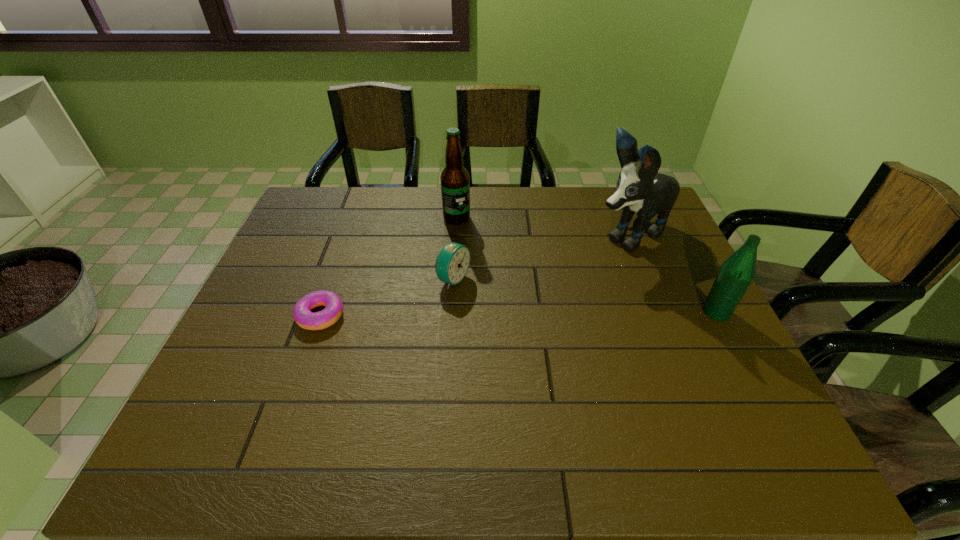
Image resolution: width=960 pixels, height=540 pixels. Identify the location of vacant area situated on the front-facing side of the alarm clock. (563, 329).

You are a GUI agent. You are given a task and a screenshot of the screen. Output one action in this format:
    pyautogui.click(x=<x>, y=<y>)
    Task: Click on the free spot located 0.090m on the front-facing side of the alarm clock
    The image size is (960, 540).
    Given the screenshot: What is the action you would take?
    [496, 300]

Find the location of a particular element. vacant space located 0.130m on the front-facing side of the tallest object is located at coordinates 568,268.

The image size is (960, 540). In order to click on vacant space located 0.380m on the front-facing side of the tallest object in this screenshot , I will do `click(499, 306)`.

I want to click on vacant area located on the front-facing side of the tallest object, so click(x=540, y=284).

The image size is (960, 540). What are the coordinates of `vacant space situated 0.190m on the label of the beer bottle` in the screenshot? It's located at (472, 265).

At what (x,y) coordinates should I click in order to perform the action: click on free spot located on the label of the beer bottle. Please return your answer as a coordinate pair (x, y). The width and height of the screenshot is (960, 540). Looking at the image, I should click on (463, 235).

The width and height of the screenshot is (960, 540). Identify the location of blank area located on the label of the beer bottle. (483, 296).

Image resolution: width=960 pixels, height=540 pixels. What are the coordinates of `puppy at the far edge` in the screenshot? It's located at (640, 188).

This screenshot has width=960, height=540. Identify the location of beer bottle that is at the far edge. (455, 184).